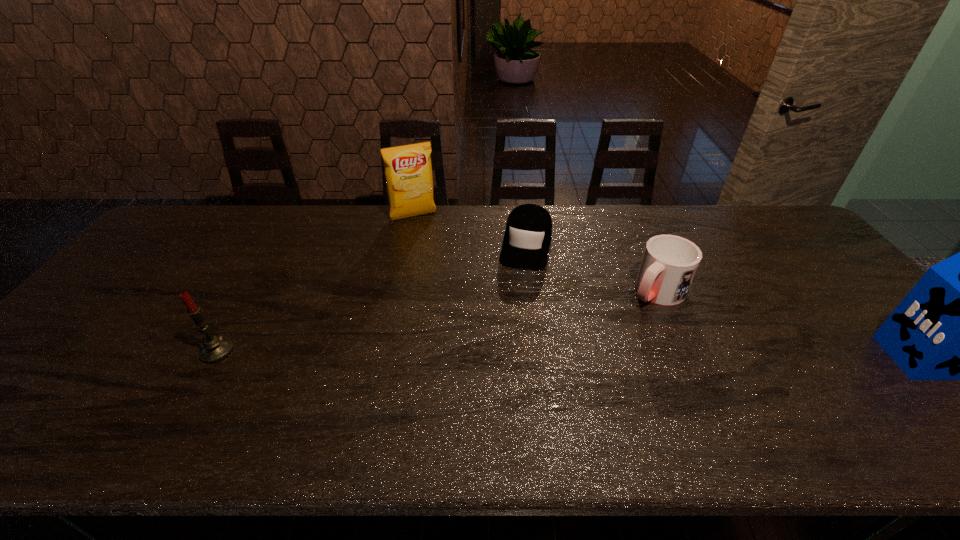
Find the location of a particular element. empty space between the leftmost object and the fourth tallest object is located at coordinates (437, 321).

Image resolution: width=960 pixels, height=540 pixels. I want to click on vacant area that lies between the third shortest object and the fourth tallest object, so click(437, 321).

This screenshot has width=960, height=540. I want to click on blank region between the cap and the mug, so click(x=591, y=268).

Locate which object ranks in proximity to the shortest object. Please provide its 2D coordinates. Your answer should be formatted as a tuple, i.e. [(x, y)], where the tuple contains the x and y coordinates of a point satisfying the conditions above.

[(669, 263)]

Select which object appears as the closest to the fourth tallest object. Please provide its 2D coordinates. Your answer should be formatted as a tuple, i.e. [(x, y)], where the tuple contains the x and y coordinates of a point satisfying the conditions above.

[(527, 238)]